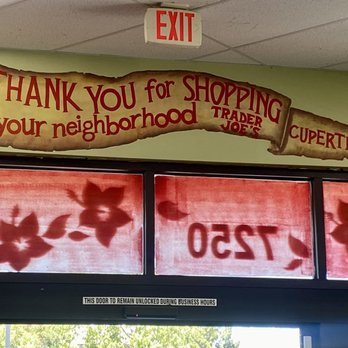
Identify the location of exit sign. (177, 29).